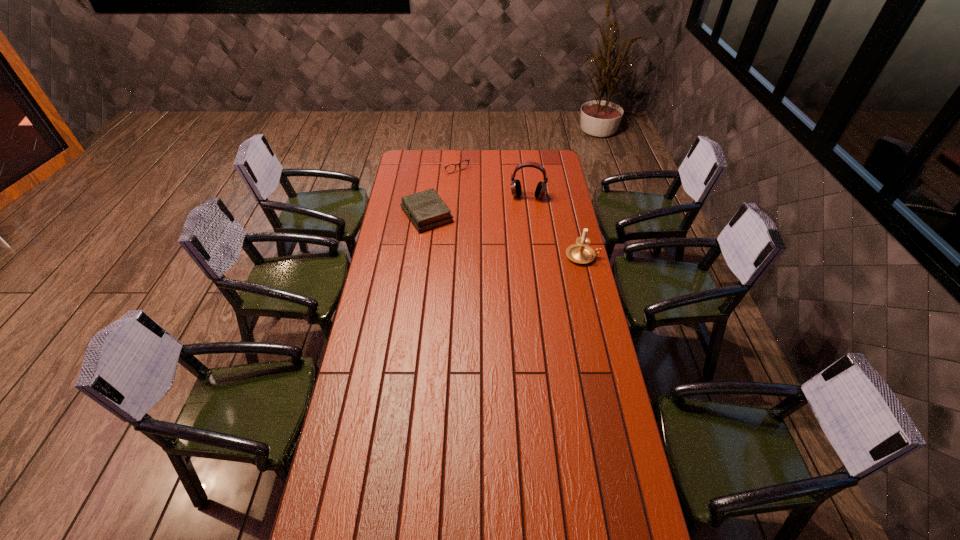
You are a GUI agent. You are given a task and a screenshot of the screen. Output one action in this format:
    pyautogui.click(x=<x>, y=<y>)
    Task: Click on the free spot between the rightmost object and the book
    The height and width of the screenshot is (540, 960).
    Given the screenshot: What is the action you would take?
    pyautogui.click(x=505, y=235)

Identify the location of vacant area between the second tallest object and the headset. (555, 226).

Where is `free space that is in between the third shortest object and the book`? The height and width of the screenshot is (540, 960). free space that is in between the third shortest object and the book is located at coordinates (505, 235).

Image resolution: width=960 pixels, height=540 pixels. Identify the location of object that is the closest to the farthest object. coord(426,210).

Identify which object is the third nearest to the third object from left to right. Please provide its 2D coordinates. Your answer should be formatted as a tuple, i.e. [(x, y)], where the tuple contains the x and y coordinates of a point satisfying the conditions above.

[(581, 253)]

Locate an element on the screen. The image size is (960, 540). free location that satisfies the following two spatial constraints: 1. on the front side of the third shortest object; 2. with a handle on the side of the second object from right to left is located at coordinates (536, 256).

Locate an element on the screen. The width and height of the screenshot is (960, 540). vacant space that satisfies the following two spatial constraints: 1. on the front side of the headset; 2. with a handle on the side of the rightmost object is located at coordinates (536, 256).

The width and height of the screenshot is (960, 540). I want to click on free space in the image that satisfies the following two spatial constraints: 1. on the front side of the nearest object; 2. with a handle on the side of the book, so click(x=421, y=256).

The width and height of the screenshot is (960, 540). Identify the location of vacant space that satisfies the following two spatial constraints: 1. on the back side of the book; 2. on the right side of the spectacles. (434, 164).

You are a GUI agent. You are given a task and a screenshot of the screen. Output one action in this format:
    pyautogui.click(x=<x>, y=<y>)
    Task: Click on the free space that satisfies the following two spatial constraints: 1. on the front side of the candle holder; 2. with a handle on the side of the farthest object
    The width and height of the screenshot is (960, 540).
    Given the screenshot: What is the action you would take?
    pyautogui.click(x=443, y=256)